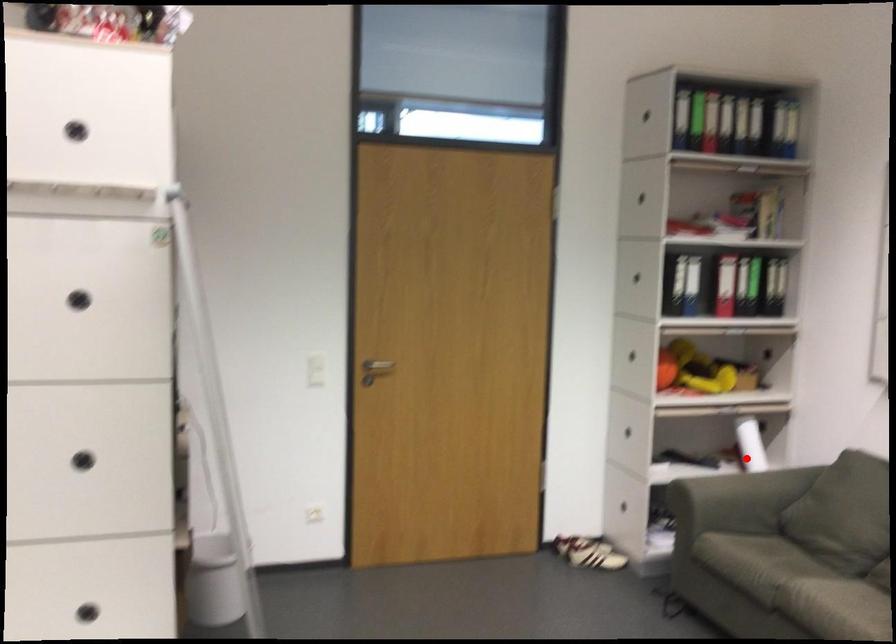
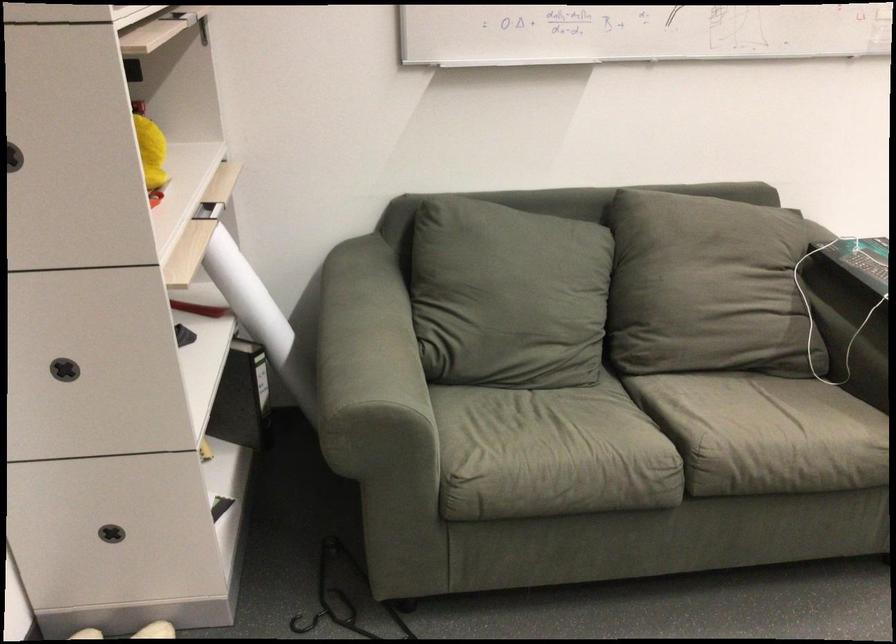
Where in the second image is the point corresponding to the highlighted location from the first image?

(247, 296)